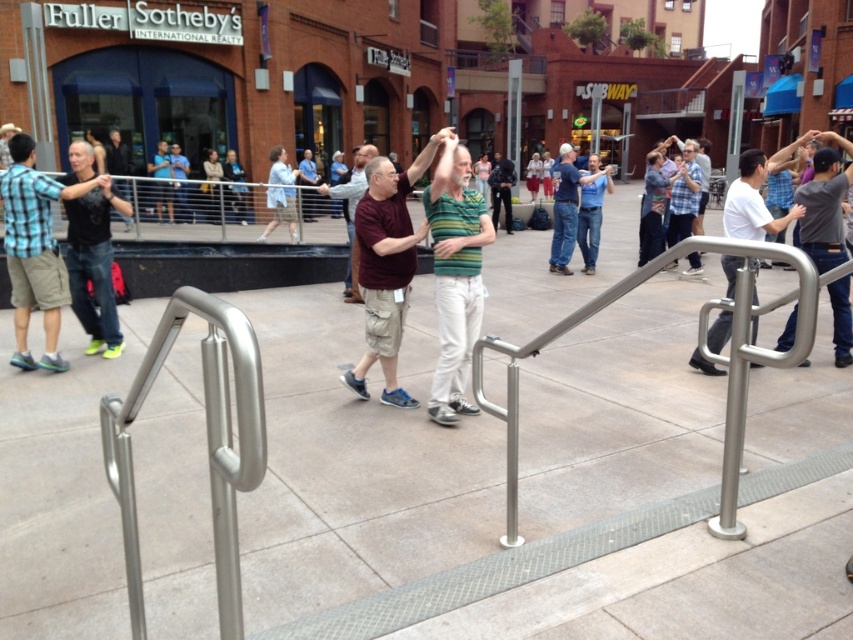
Question: Which point is farther from the camera taking this photo?

Choices:
 (A) pyautogui.click(x=447, y=371)
 (B) pyautogui.click(x=102, y=314)

Answer: (B)

Question: Which object appears farthest from the camera in this image?

Choices:
 (A) blue jeans at center
 (B) blue plaid shirt at center
 (C) black matte shirt at center
 (D) gray cotton shirt at right

Answer: (A)

Question: Can you confirm if green striped shirt at center is thinner than matte black shirt at left?

Choices:
 (A) yes
 (B) no

Answer: (A)

Question: Does white matte shirt at right have a smaller size compared to blue plaid shirt at center?

Choices:
 (A) yes
 (B) no

Answer: (A)

Question: Is matte black shirt at left to the left of blue plaid shirt at center from the viewer's perspective?

Choices:
 (A) yes
 (B) no

Answer: (A)

Question: Which point appears farthest from the camera in this image?

Choices:
 (A) (415, 260)
 (B) (334, 188)
 (C) (38, 218)

Answer: (B)